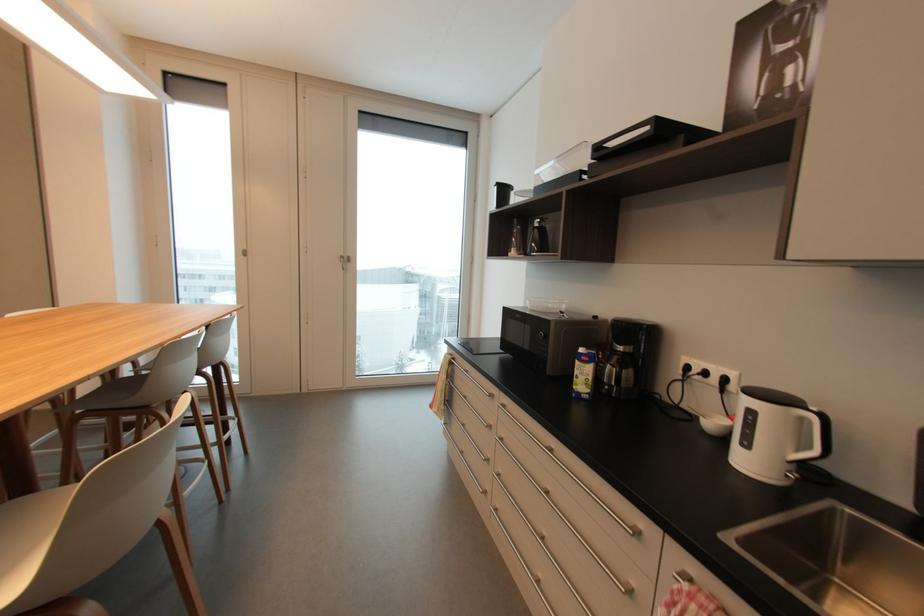
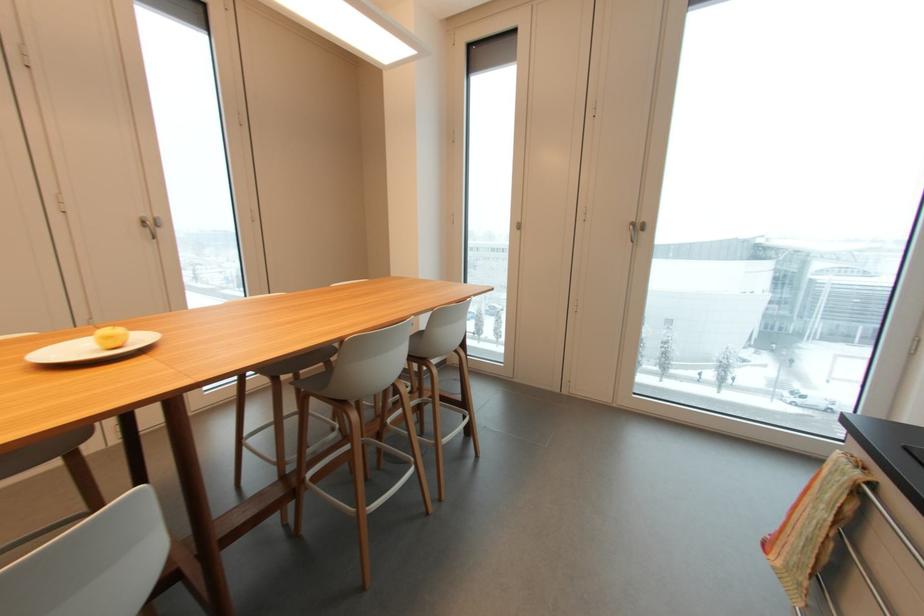
In the second image, find the point that corresponds to the point at 351,264 in the first image.

(643, 233)